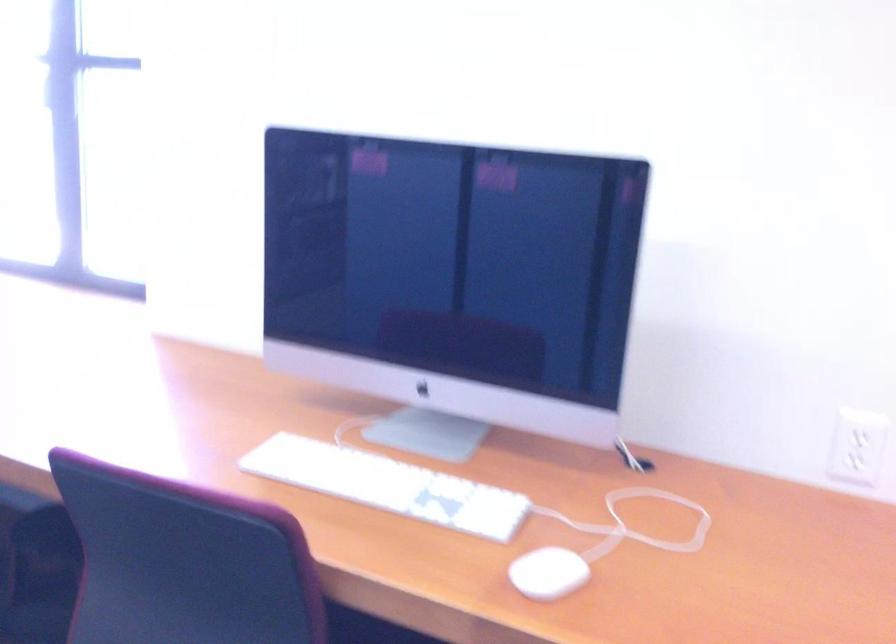
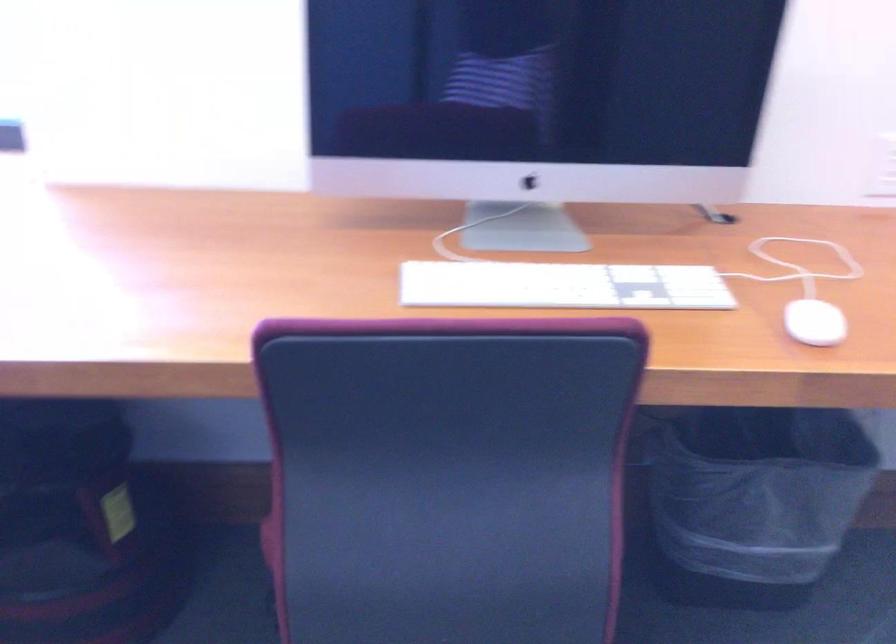
Looking at this image, what movement of the cameraman would produce the second image?

The cameraman walked toward left, forward.